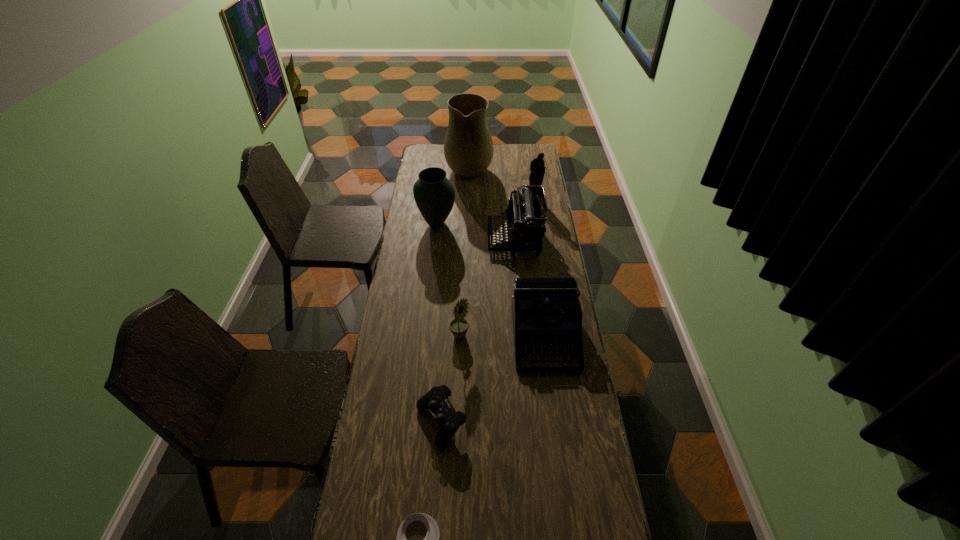
At what (x,y) coordinates should I click in order to perform the action: click on the farthest object. Please return your answer as a coordinate pair (x, y). Looking at the image, I should click on (468, 147).

Find the location of a particular element. The image size is (960, 540). cream pitcher is located at coordinates pos(468,147).

You are a GUI agent. You are given a task and a screenshot of the screen. Output one action in this format:
    pyautogui.click(x=<x>, y=<y>)
    Task: Click on the vase
    This screenshot has width=960, height=540.
    Given the screenshot: What is the action you would take?
    pyautogui.click(x=434, y=194)

Where is `figurine`? The width and height of the screenshot is (960, 540). figurine is located at coordinates (537, 168).

Find the location of a particular element. This screenshot has height=540, width=960. the taller typewriter is located at coordinates (526, 215).

Locate an element on the screen. sunflower is located at coordinates (458, 326).

This screenshot has height=540, width=960. I want to click on the sixth tallest object, so click(x=546, y=311).

This screenshot has width=960, height=540. I want to click on the shorter typewriter, so click(546, 311).

At what (x,y) coordinates should I click in order to perform the action: click on control. Please return your answer as a coordinate pair (x, y). This screenshot has height=540, width=960. Looking at the image, I should click on (436, 400).

Identify the location of the second shortest object. (436, 400).